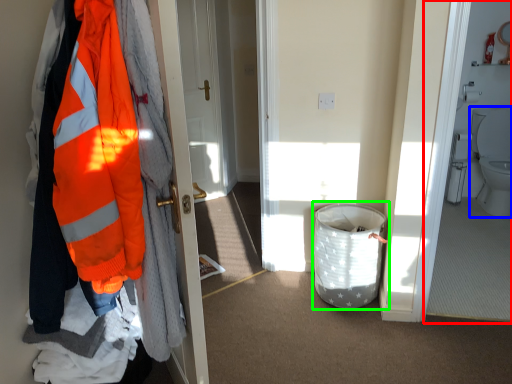
Question: Estimate the real-world distances between objects in this image. Which object is farther from corridor (highlighted by a red box), toilet (highlighted by a blue box) or laundry basket (highlighted by a green box)?

Choices:
 (A) toilet
 (B) laundry basket

Answer: (B)